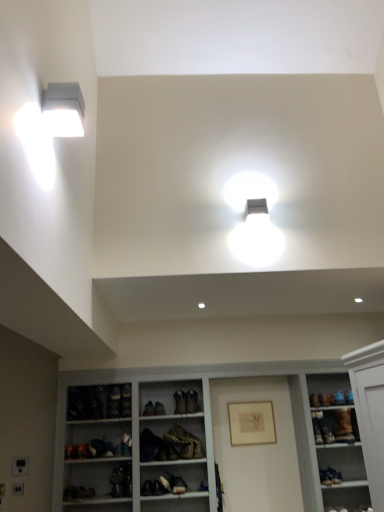
Question: Is matte black shoe at center, positioned as the second shoe in right-to-left order, to the left or to the right of leather jacket at center in the image?

Choices:
 (A) left
 (B) right

Answer: (B)

Question: In the image, is matte black shoe at center, positioned as the second shoe in right-to-left order, positioned in front of or behind leather jacket at center?

Choices:
 (A) front
 (B) behind

Answer: (B)

Question: Considering the real-world distances, which object is farthest from the matte black shoe at center, positioned as the second shoe in right-to-left order?

Choices:
 (A) brown suede shoe at lower right, the first shoe viewed from the right
 (B) matte black shoe at center, the third shoe viewed from the right
 (C) white matte exhaust hood at upper left
 (D) white wood shelves at center
 (E) leather jacket at center

Answer: (C)

Question: Based on their relative distances, which object is nearer to the white wood shelves at center?

Choices:
 (A) leather jacket at center
 (B) matte black shoe at center, positioned as the second shoe in right-to-left order
 (C) white matte rectangular light fixture at upper left
 (D) white matte exhaust hood at upper left
 (E) matte black shoe at center, the 1th shoe from the left

Answer: (A)